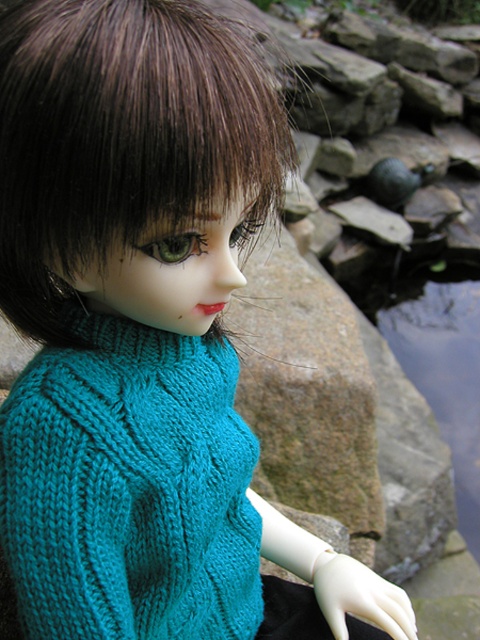
You are a photographer trying to capture the teal knitted sweater at center in a close shot. What coordinates should you focus on to ensure the sweater is in the center of your frame?

You should focus on the coordinates point (130, 488) to ensure the teal knitted sweater at center is in the center of your frame.

You are a photographer trying to capture the doll in the image. You notice two specific points marked as point 1 at coordinates point (224, 548) and point 2 at coordinates point (113, 152). If you want to focus on the point that is closer to the camera, which point should you choose?

Point 2 at coordinates point (113, 152) is closer to the camera since it is in front of point 1 at coordinates point (224, 548).

Looking at this image, you are a fashion designer observing the doll in the image. You need to decide whether the teal knitted sweater at center will cover the brownhair at center completely. Based on their sizes, can you determine if the sweater is long enough?

The teal knitted sweater at center is much taller than brownhair at center, so yes, the sweater will cover the brownhair at center completely.